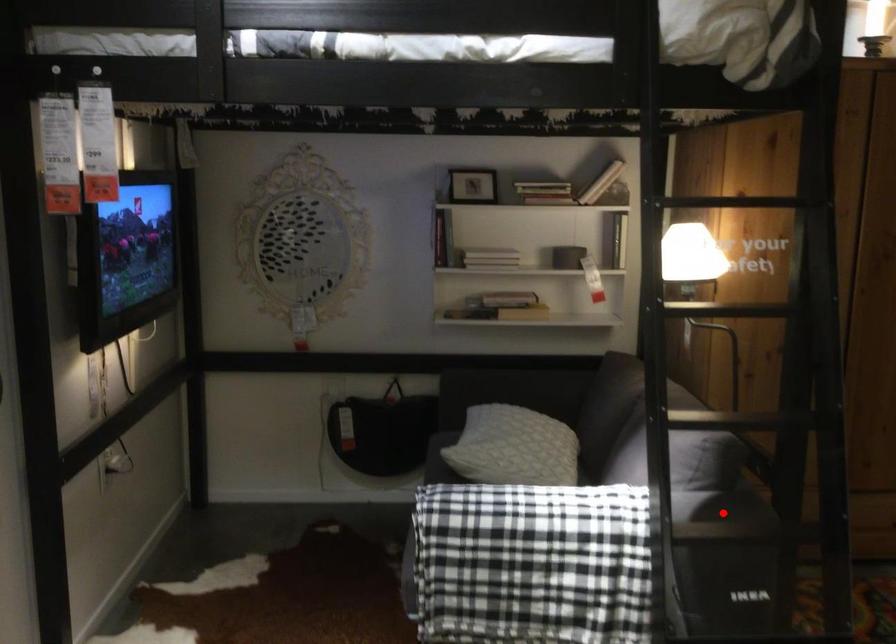
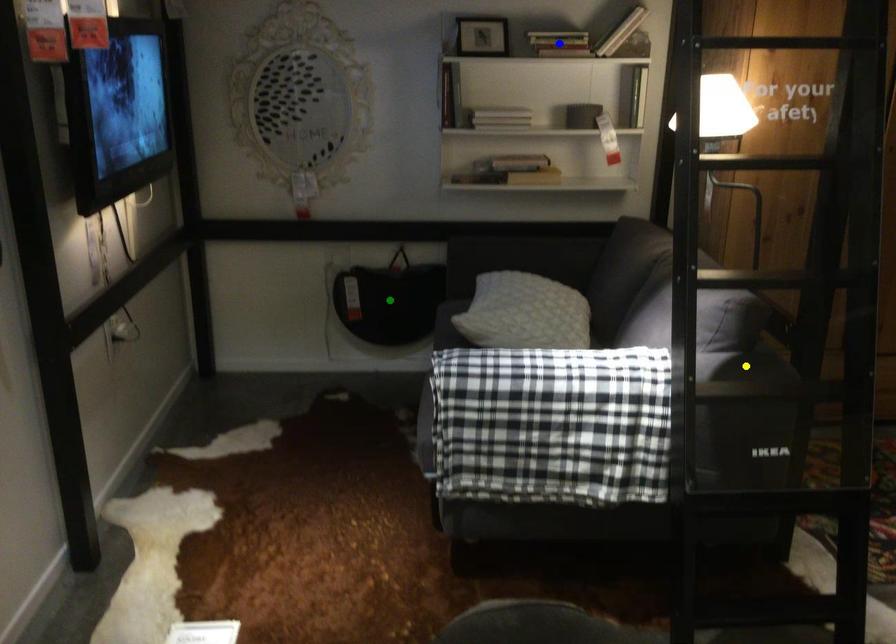
Question: I am providing you with two images of the same scene from different viewpoints. A red point is marked on the first image. You are given multiple points on the second image. Which point in image 2 is actually the same real-world point as the red point in image 1?

Choices:
 (A) yellow point
 (B) green point
 (C) blue point

Answer: (A)